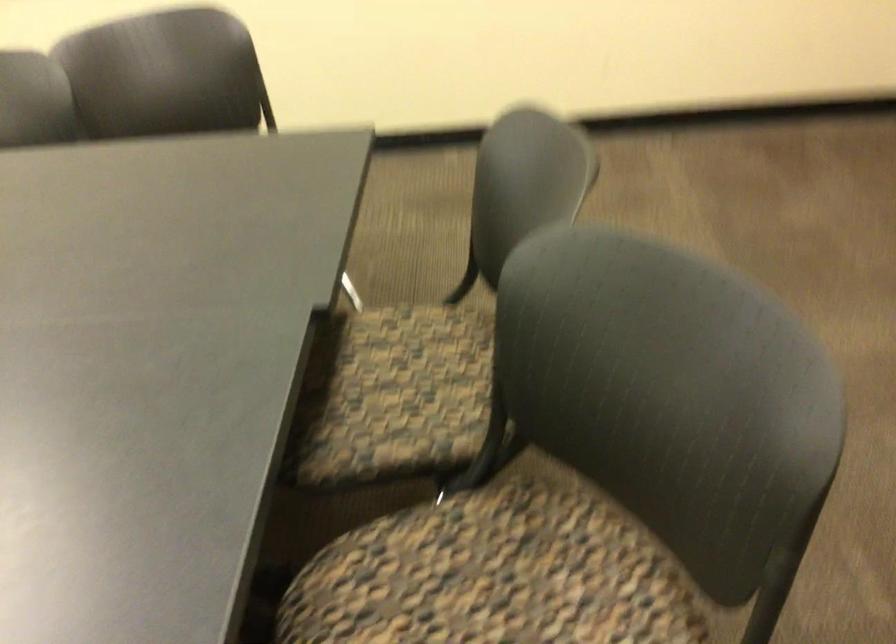
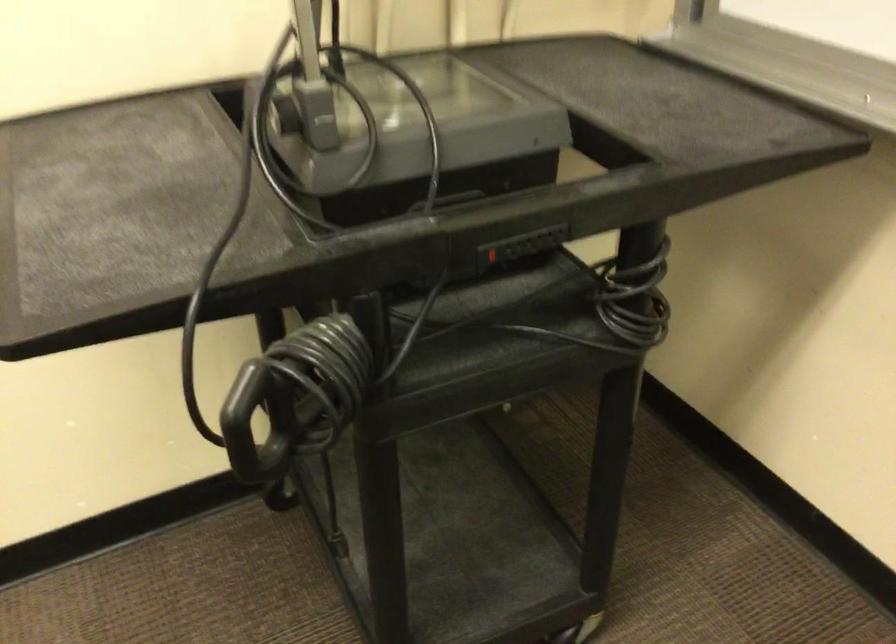
Based on the continuous images, in which direction is the camera rotating?

The camera rotated toward right-down.